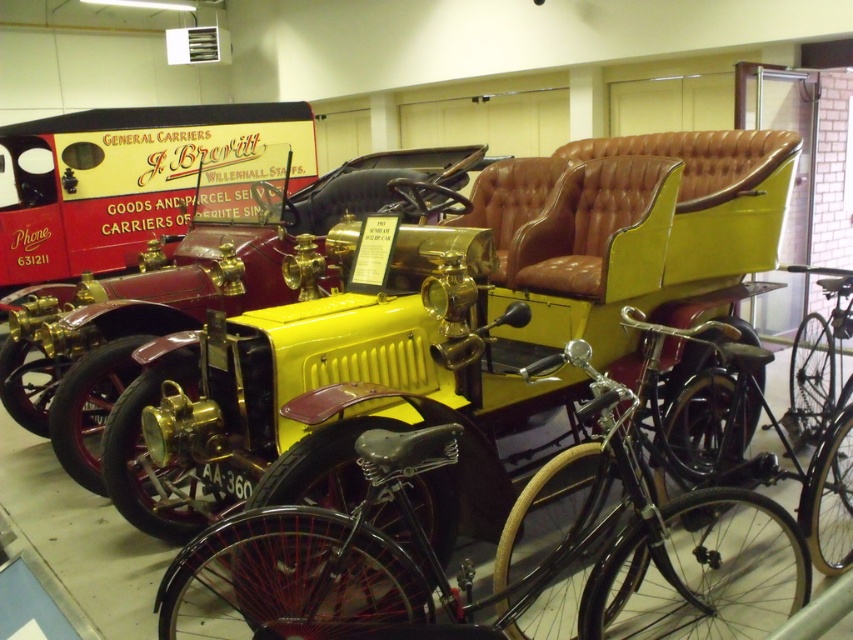
Between yellow leather car at center and shiny black bicycle at center, which one has less height?

shiny black bicycle at center is shorter.

Which is in front, point (596, 339) or point (582, 522)?

Positioned in front is point (582, 522).

Where is `yellow leather car at center`? yellow leather car at center is located at coordinates (473, 321).

Measure the distance between shiny black bicycle at center and yellow matte car at center.

shiny black bicycle at center is 1.98 meters away from yellow matte car at center.

Which is in front, point (415, 454) or point (440, 164)?

Point (415, 454)

This screenshot has width=853, height=640. What are the coordinates of `shiny black bicycle at center` in the screenshot? It's located at (496, 548).

Who is more distant from viewer, (630,545) or (804,531)?

Positioned behind is point (804,531).

Can you confirm if shiny black bicycle at center is positioned above black matte bicycle at center?

Actually, shiny black bicycle at center is below black matte bicycle at center.

Where is `shiny black bicycle at center`? shiny black bicycle at center is located at coordinates pyautogui.click(x=496, y=548).